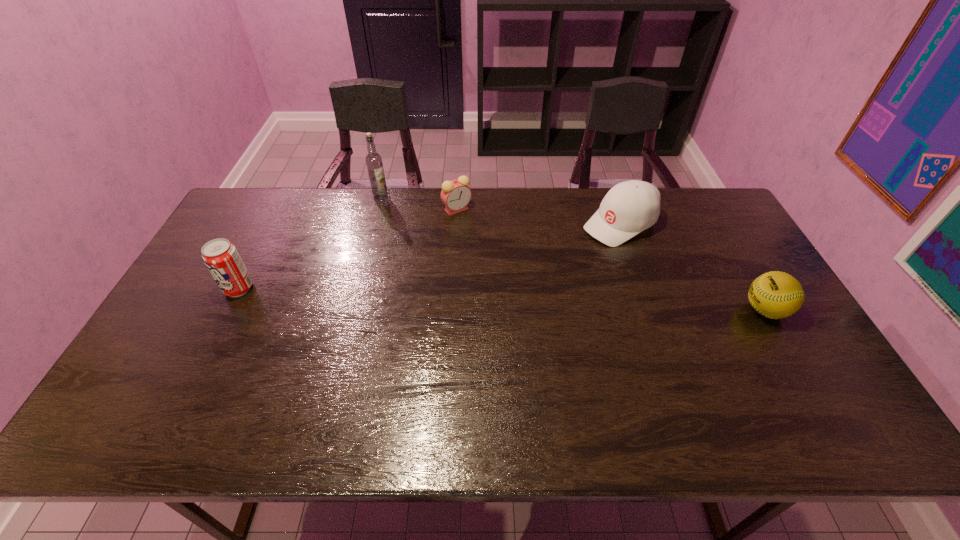
What are the coordinates of `alarm clock located at the far edge` in the screenshot? It's located at (455, 194).

Find the location of `baseball cap that is at the far edge`. baseball cap that is at the far edge is located at coordinates (630, 207).

Find the location of a particular element. The height and width of the screenshot is (540, 960). object at the left edge is located at coordinates (221, 257).

What are the coordinates of `object that is at the right edge` in the screenshot? It's located at (775, 294).

Where is `free space at the far edge of the desktop`? free space at the far edge of the desktop is located at coordinates (525, 199).

Identify the location of vacant space at the near edge of the desktop. Image resolution: width=960 pixels, height=540 pixels. pos(265,374).

The width and height of the screenshot is (960, 540). Identify the location of vacant space at the left edge of the desktop. (174, 320).

Locate an element on the screen. This screenshot has width=960, height=540. vacant region at the right edge of the desktop is located at coordinates (756, 321).

In the image, there is a desktop. Where is `blank space at the far left corner`? Image resolution: width=960 pixels, height=540 pixels. blank space at the far left corner is located at coordinates (271, 221).

Locate an element on the screen. vacant area that lies between the rightmost object and the tallest object is located at coordinates (573, 254).